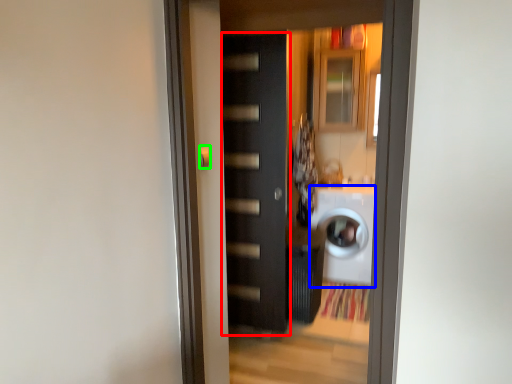
Question: Which object is the closest to the door (highlighted by a red box)? Choose among these: washing machine (highlighted by a blue box) or door handle (highlighted by a green box).

Choices:
 (A) washing machine
 (B) door handle

Answer: (A)